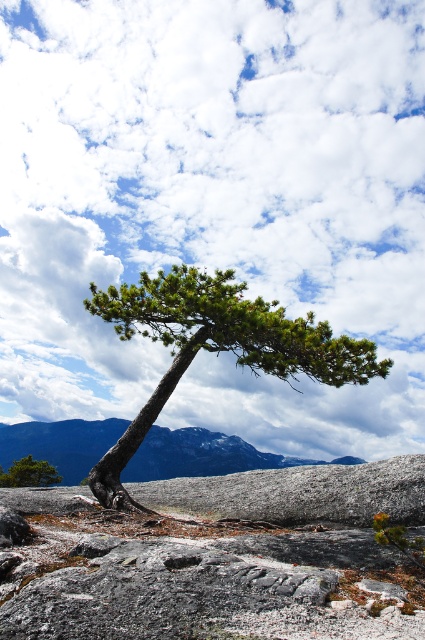
Question: Is green textured pine tree at center closer to camera compared to gray rocky mountain at center?

Choices:
 (A) no
 (B) yes

Answer: (B)

Question: Is green textured pine tree at center wider than gray rocky mountain at center?

Choices:
 (A) yes
 (B) no

Answer: (B)

Question: Where is gray rocky mountain at center located in relation to green matte tree at lower left in the image?

Choices:
 (A) below
 (B) above

Answer: (A)

Question: Which of the following is the closest to the observer?

Choices:
 (A) (125, 468)
 (B) (25, 476)
 (C) (217, 305)

Answer: (C)

Question: Which of the following is the closest to the observer?

Choices:
 (A) gray rocky mountain at center
 (B) green textured pine tree at center

Answer: (B)

Question: Which point appears closest to the camera in this image?

Choices:
 (A) (0, 484)
 (B) (280, 365)

Answer: (B)